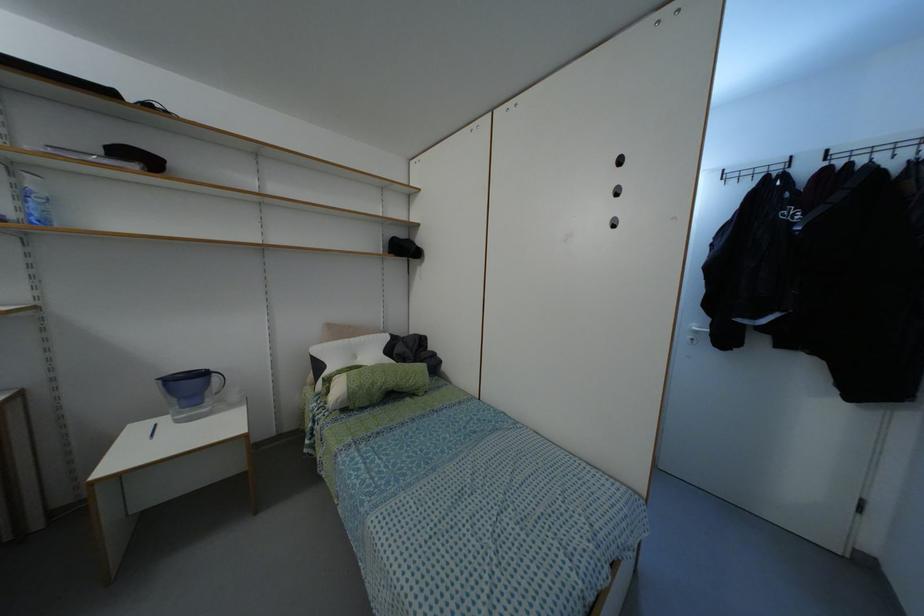
Where would you pull the white door handle? Please return your answer as a coordinate pair (x, y).

(698, 329)